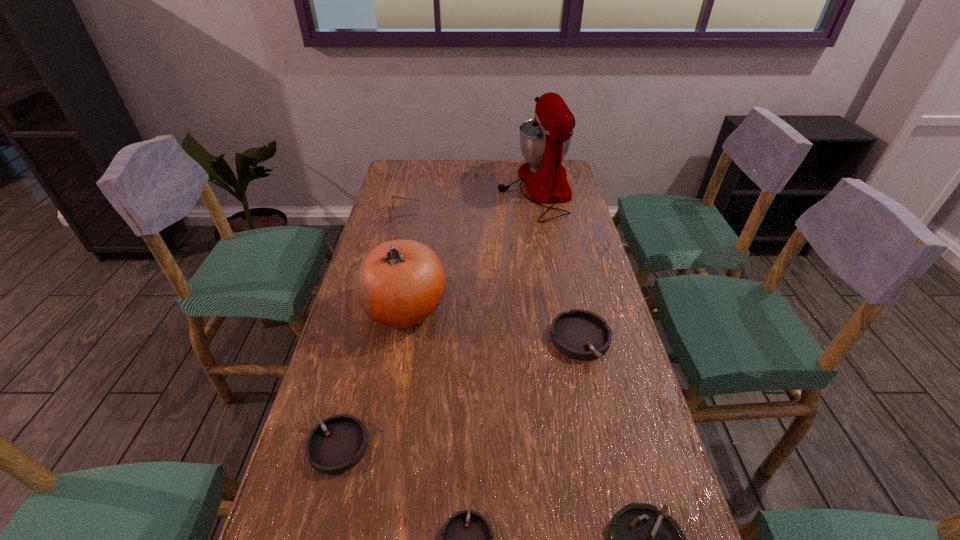
The height and width of the screenshot is (540, 960). In order to click on red mixer in this screenshot , I will do `click(545, 140)`.

You are a GUI agent. You are given a task and a screenshot of the screen. Output one action in this format:
    pyautogui.click(x=<x>, y=<y>)
    Task: Click on the mixer
    
    Given the screenshot: What is the action you would take?
    pyautogui.click(x=545, y=140)

This screenshot has width=960, height=540. Identify the location of orange pumpkin. (399, 283).

You are a GUI agent. You are given a task and a screenshot of the screen. Output one action in this format:
    pyautogui.click(x=<x>, y=<y>)
    Task: Click on the pumpkin
    Image resolution: width=960 pixels, height=540 pixels.
    Given the screenshot: What is the action you would take?
    pyautogui.click(x=399, y=283)

Identify the location of spectacles. (392, 199).

Identify the location of the third tallest object. (392, 199).

Identify the location of the farthest gray ashtray. (579, 334).

This screenshot has width=960, height=540. Identify the location of the biggest gray ashtray. (579, 334).

Find the location of a particular element. The width and height of the screenshot is (960, 540). the second smallest gray ashtray is located at coordinates (335, 445).

Identify the location of the second tallest ashtray. The width and height of the screenshot is (960, 540). (335, 445).